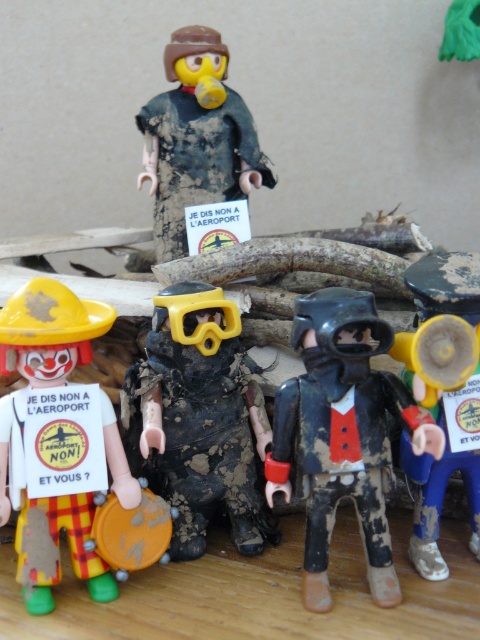
How distant is matte black diving suit at center from yellow matte megaphone at right?

matte black diving suit at center is 7.39 inches away from yellow matte megaphone at right.

Is point (191, 461) closer to viewer compared to point (478, 419)?

No, it is not.

Is point (179, 353) positioned after point (471, 364)?

Yes, it is.

What are the coordinates of `matte black diving suit at center` in the screenshot? It's located at click(202, 419).

Which is below, matte black diving suit at center or matte yellow hat at left?

matte yellow hat at left is below.

Does point (191, 502) come farther from viewer compared to point (6, 438)?

Yes, point (191, 502) is farther from viewer.

In order to click on matte black diving suit at center in this screenshot , I will do `click(202, 419)`.

Does matte yellow hat at left have a greater width compared to dirty plastic figure at upper center?

Incorrect, matte yellow hat at left's width does not surpass dirty plastic figure at upper center's.

In the scene shown: Can you confirm if matte yellow hat at left is smaller than dirty plastic figure at upper center?

Indeed, matte yellow hat at left has a smaller size compared to dirty plastic figure at upper center.

Identify the location of matte yellow hat at left. (45, 522).

Identify the location of matte yellow hat at left. 45,522.